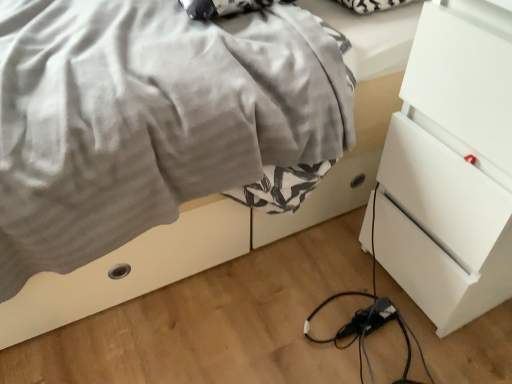
You are a GUI agent. You are given a task and a screenshot of the screen. Output one action in this format:
    pyautogui.click(x=<x>, y=<y>)
    Task: Click on the satin gray blanket at center
    This screenshot has width=512, height=384.
    Given the screenshot: What is the action you would take?
    pyautogui.click(x=148, y=118)

Measure the distance between black plastic extension cord at lower center and camera.

The distance of black plastic extension cord at lower center from camera is 39.05 inches.

Where is `satin gray blanket at center`? The image size is (512, 384). satin gray blanket at center is located at coordinates (148, 118).

In terms of width, does white glossy chest of drawers at right look wider or thinner when compared to satin gray blanket at center?

Clearly, white glossy chest of drawers at right has less width compared to satin gray blanket at center.

Considering the relative positions of white glossy chest of drawers at right and satin gray blanket at center in the image provided, is white glossy chest of drawers at right to the left of satin gray blanket at center from the viewer's perspective?

In fact, white glossy chest of drawers at right is to the right of satin gray blanket at center.

Between white glossy chest of drawers at right and satin gray blanket at center, which one has smaller size?

Smaller between the two is white glossy chest of drawers at right.

Based on the photo, from a real-world perspective, is white glossy chest of drawers at right located higher than satin gray blanket at center?

No, from a real-world perspective, white glossy chest of drawers at right is not over satin gray blanket at center

Is satin gray blanket at center spatially inside black plastic extension cord at lower center, or outside of it?

satin gray blanket at center exists outside the volume of black plastic extension cord at lower center.

Locate an element on the screen. The height and width of the screenshot is (384, 512). blanket above the black plastic extension cord at lower center (from a real-world perspective) is located at coordinates [x=148, y=118].

How many degrees apart are the facing directions of satin gray blanket at center and black plastic extension cord at lower center?

The angular difference between satin gray blanket at center and black plastic extension cord at lower center is 84 degrees.

Which is more distant, (50,153) or (353,319)?

The point (353,319) is behind.

Identify the location of chest of drawers above the black plastic extension cord at lower center (from a real-world perspective). (451, 166).

Is the surface of white glossy chest of drawers at right in direct contact with black plastic extension cord at lower center?

No, white glossy chest of drawers at right is not next to black plastic extension cord at lower center.

Looking at this image, is white glossy chest of drawers at right positioned with its back to black plastic extension cord at lower center?

No.

Is black plastic extension cord at lower center taller or shorter than white glossy chest of drawers at right?

Considering their sizes, black plastic extension cord at lower center has less height than white glossy chest of drawers at right.

From a real-world perspective, which is physically below, black plastic extension cord at lower center or white glossy chest of drawers at right?

black plastic extension cord at lower center.

Is black plastic extension cord at lower center looking in the opposite direction of white glossy chest of drawers at right?

Yes, black plastic extension cord at lower center is positioned with its back facing white glossy chest of drawers at right.

Between black plastic extension cord at lower center and white glossy chest of drawers at right, which one has larger size?

With larger size is white glossy chest of drawers at right.

Is the position of satin gray blanket at center more distant than that of white glossy chest of drawers at right?

Yes, the depth of satin gray blanket at center is greater than that of white glossy chest of drawers at right.

From a real-world perspective, is satin gray blanket at center below white glossy chest of drawers at right?

No.

Is satin gray blanket at center facing towards white glossy chest of drawers at right?

No, satin gray blanket at center does not turn towards white glossy chest of drawers at right.

In the image, is black plastic extension cord at lower center on the left side or the right side of satin gray blanket at center?

In the image, black plastic extension cord at lower center appears on the right side of satin gray blanket at center.

Does point (351, 320) come farther from viewer compared to point (102, 137)?

Yes, point (351, 320) is behind point (102, 137).

Is black plastic extension cord at lower center turned away from satin gray blanket at center?

No, satin gray blanket at center is not at the back of black plastic extension cord at lower center.

Is black plastic extension cord at lower center inside or outside of satin gray blanket at center?

The correct answer is: outside.

This screenshot has height=384, width=512. What are the coordinates of `the chest of drawers in front of the satin gray blanket at center` in the screenshot? It's located at (451, 166).

The width and height of the screenshot is (512, 384). Identify the location of extension cord below the satin gray blanket at center (from the image's perspective). (369, 319).

From the image, which object appears to be farther from white glossy chest of drawers at right, black plastic extension cord at lower center or satin gray blanket at center?

Among the two, satin gray blanket at center is located further to white glossy chest of drawers at right.

Estimate the real-world distances between objects in this image. Which object is closer to white glossy chest of drawers at right, satin gray blanket at center or black plastic extension cord at lower center?

black plastic extension cord at lower center is closer to white glossy chest of drawers at right.

From the image, which object appears to be farther from satin gray blanket at center, white glossy chest of drawers at right or black plastic extension cord at lower center?

black plastic extension cord at lower center.

Looking at this image, which object lies further to the anchor point satin gray blanket at center, black plastic extension cord at lower center or white glossy chest of drawers at right?

black plastic extension cord at lower center is further to satin gray blanket at center.

When comparing their distances from black plastic extension cord at lower center, does satin gray blanket at center or white glossy chest of drawers at right seem closer?

white glossy chest of drawers at right is positioned closer to the anchor black plastic extension cord at lower center.

From the image, which object appears to be nearer to black plastic extension cord at lower center, white glossy chest of drawers at right or satin gray blanket at center?

white glossy chest of drawers at right is positioned closer to the anchor black plastic extension cord at lower center.

Locate an element on the screen. Image resolution: width=512 pixels, height=384 pixels. extension cord between satin gray blanket at center and white glossy chest of drawers at right in the horizontal direction is located at coordinates (369, 319).